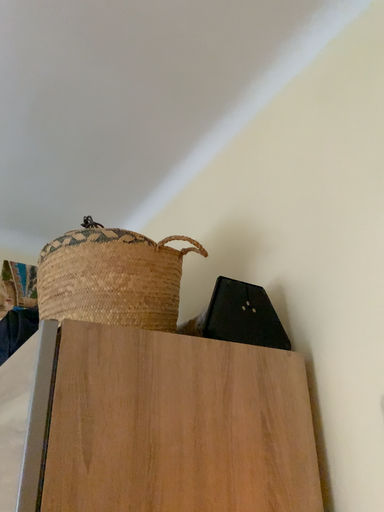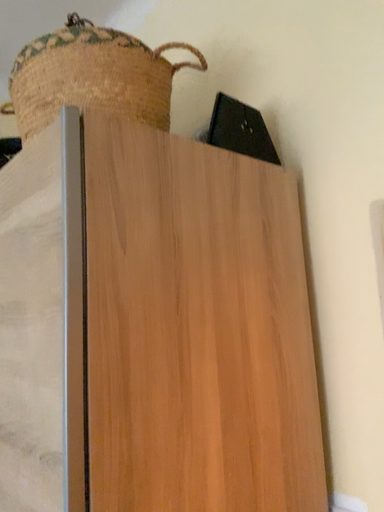
Question: Which way did the camera rotate in the video?

Choices:
 (A) rotated upward
 (B) rotated downward

Answer: (B)